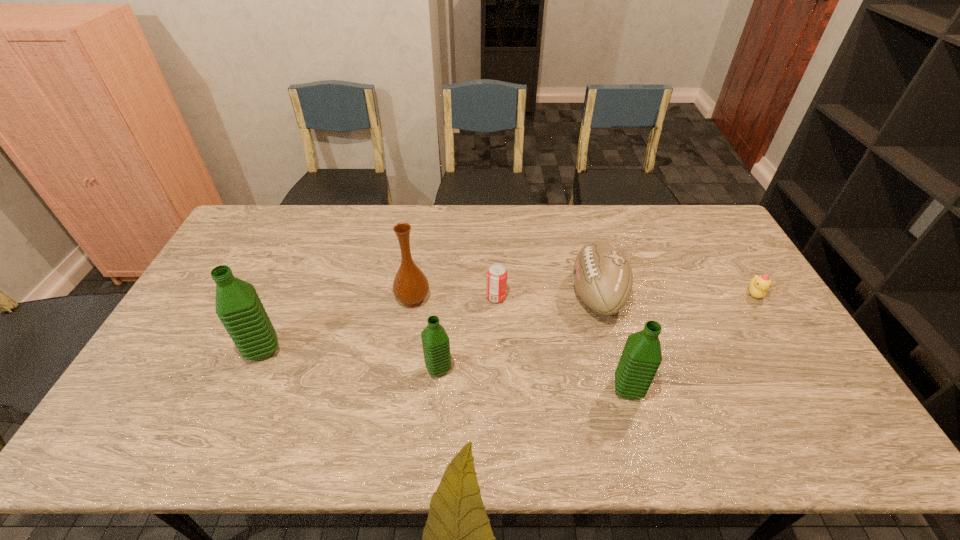
Identify the location of vacant point located between the rightmost water bottle and the fifth tallest object. The image size is (960, 540). (612, 342).

This screenshot has width=960, height=540. What are the coordinates of `vacant area that lies between the fourth tallest object and the rightmost water bottle` in the screenshot? It's located at (533, 380).

At what (x,y) coordinates should I click in order to perform the action: click on vacant region between the football (American) and the fourth object from right to left. Please return your answer as a coordinate pair (x, y). Image resolution: width=960 pixels, height=540 pixels. Looking at the image, I should click on (546, 296).

Identify the location of vacant region between the third shortest object and the fourth tallest object. Image resolution: width=960 pixels, height=540 pixels. (517, 333).

Locate an element on the screen. This screenshot has height=540, width=960. vacant space that's between the shortest water bottle and the duckling is located at coordinates (596, 332).

Where is `vacant space in between the rightmost water bottle and the shortest water bottle`? This screenshot has height=540, width=960. vacant space in between the rightmost water bottle and the shortest water bottle is located at coordinates tap(533, 380).

The image size is (960, 540). Identify the location of vacant space that's between the fifth tallest object and the second tallest water bottle. (612, 342).

Identify the location of the fifth closest object to the fifth tallest object. (410, 286).

You are a GUI agent. You are given a task and a screenshot of the screen. Output one action in this format:
    pyautogui.click(x=<x>, y=<y>)
    Task: Click on the object that stands as the third closest to the fourth tallest object
    This screenshot has height=540, width=960.
    Given the screenshot: What is the action you would take?
    pyautogui.click(x=602, y=275)

You are a GUI agent. You are given a task and a screenshot of the screen. Output one action in this format:
    pyautogui.click(x=<x>, y=<y>)
    Task: Click on the closest water bottle to the second water bottle from left to right
    The image size is (960, 540).
    Given the screenshot: What is the action you would take?
    pyautogui.click(x=238, y=306)